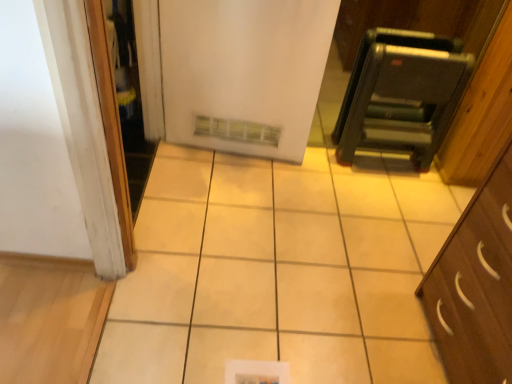
Where is `white matte refrigerator at center`? The height and width of the screenshot is (384, 512). white matte refrigerator at center is located at coordinates (244, 72).

At what (x,y) coordinates should I click in order to perform the action: click on metallic black step ladder at upper right. Please return your answer as a coordinate pair (x, y). This screenshot has height=384, width=512. Looking at the image, I should click on (401, 94).

Looking at their sizes, would you say white matte refrigerator at center is wider or thinner than metallic black step ladder at upper right?

Considering their sizes, white matte refrigerator at center looks slimmer than metallic black step ladder at upper right.

Which is correct: white matte refrigerator at center is inside metallic black step ladder at upper right, or outside of it?

white matte refrigerator at center exists outside the volume of metallic black step ladder at upper right.

From the image's perspective, is white matte refrigerator at center located beneath metallic black step ladder at upper right?

No, from the image's perspective, white matte refrigerator at center is not beneath metallic black step ladder at upper right.

How many degrees apart are the facing directions of metallic black step ladder at upper right and white matte refrigerator at center?

1.42 degrees separate the facing orientations of metallic black step ladder at upper right and white matte refrigerator at center.

Is metallic black step ladder at upper right further to the viewer compared to white matte refrigerator at center?

Yes.

From the image's perspective, is metallic black step ladder at upper right above white matte refrigerator at center?

Actually, metallic black step ladder at upper right appears below white matte refrigerator at center in the image.

Looking at this image, is white glossy screen door at left not inside white matte refrigerator at center?

Indeed, white glossy screen door at left is completely outside white matte refrigerator at center.

Is white glossy screen door at left positioned with its back to white matte refrigerator at center?

No.

The width and height of the screenshot is (512, 384). What are the coordinates of `door that is on the right side of white glossy screen door at left` in the screenshot? It's located at (244, 72).

Is white glossy screen door at left positioned far away from white matte refrigerator at center?

Actually, white glossy screen door at left and white matte refrigerator at center are a little close together.

Is the depth of metallic black step ladder at upper right greater than that of white glossy screen door at left?

Yes, metallic black step ladder at upper right is further from the viewer.

Which object is positioned more to the left, metallic black step ladder at upper right or white glossy screen door at left?

white glossy screen door at left is more to the left.

Is the surface of metallic black step ladder at upper right in direct contact with white glossy screen door at left?

No, metallic black step ladder at upper right is not beside white glossy screen door at left.

Where is `appliance that appears on the right of white glossy screen door at left`? appliance that appears on the right of white glossy screen door at left is located at coordinates (401, 94).

Can you confirm if white glossy screen door at left is bigger than metallic black step ladder at upper right?

No, white glossy screen door at left is not bigger than metallic black step ladder at upper right.

From a real-world perspective, is white glossy screen door at left physically located above or below metallic black step ladder at upper right?

white glossy screen door at left is above metallic black step ladder at upper right.

Considering the positions of objects white matte refrigerator at center and white glossy screen door at left in the image provided, who is more to the right, white matte refrigerator at center or white glossy screen door at left?

white matte refrigerator at center.

From a real-world perspective, which is physically below, white matte refrigerator at center or white glossy screen door at left?

white matte refrigerator at center.

Are white matte refrigerator at center and white glossy screen door at left located far from each other?

white matte refrigerator at center is near white glossy screen door at left, not far away.

Where is `door above the metallic black step ladder at upper right (from the image's perspective)`? door above the metallic black step ladder at upper right (from the image's perspective) is located at coordinates (244, 72).

Where is `appliance on the right of white matte refrigerator at center`? appliance on the right of white matte refrigerator at center is located at coordinates (401, 94).

When comparing their distances from white glossy screen door at left, does white matte refrigerator at center or metallic black step ladder at upper right seem further?

The object further to white glossy screen door at left is metallic black step ladder at upper right.

From the image, which object appears to be farther from white glossy screen door at left, metallic black step ladder at upper right or white matte refrigerator at center?

Among the two, metallic black step ladder at upper right is located further to white glossy screen door at left.

Looking at the image, which one is located further to white matte refrigerator at center, metallic black step ladder at upper right or white glossy screen door at left?

metallic black step ladder at upper right.

When comparing their distances from metallic black step ladder at upper right, does white matte refrigerator at center or white glossy screen door at left seem further?

white glossy screen door at left lies further to metallic black step ladder at upper right than the other object.

Considering their positions, is white glossy screen door at left positioned closer to white matte refrigerator at center than metallic black step ladder at upper right?

Among the two, white glossy screen door at left is located nearer to white matte refrigerator at center.

Estimate the real-world distances between objects in this image. Which object is closer to metallic black step ladder at upper right, white glossy screen door at left or white matte refrigerator at center?

The object closer to metallic black step ladder at upper right is white matte refrigerator at center.

Locate an element on the screen. This screenshot has height=384, width=512. door between white glossy screen door at left and metallic black step ladder at upper right from left to right is located at coordinates (244, 72).